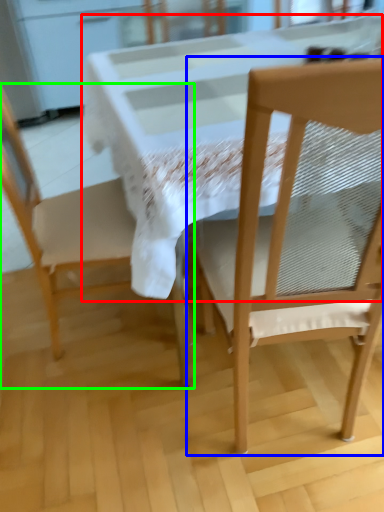
Question: Estimate the real-world distances between objects in this image. Which object is farther from round table (highlighted by a red box), chair (highlighted by a blue box) or chair (highlighted by a green box)?

Choices:
 (A) chair
 (B) chair

Answer: (B)